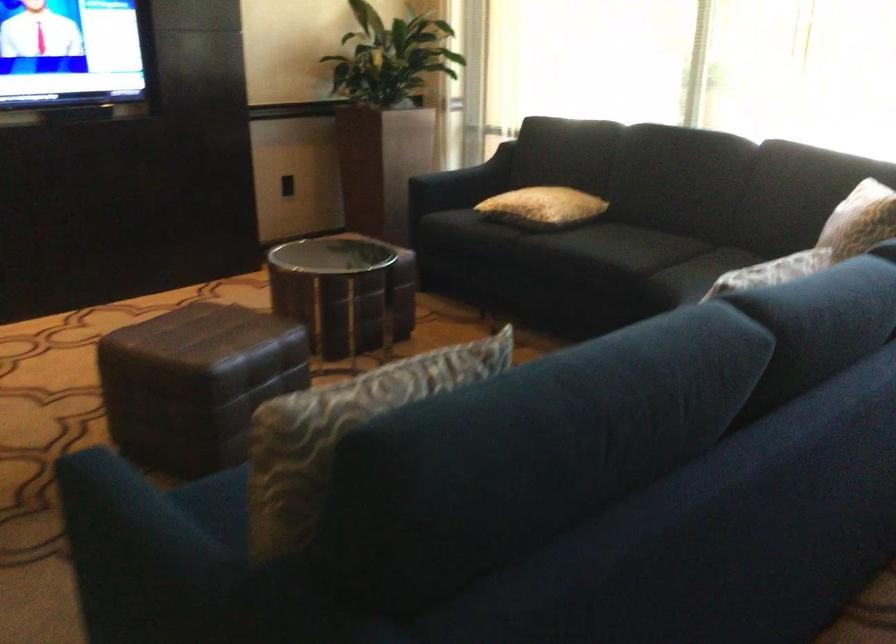
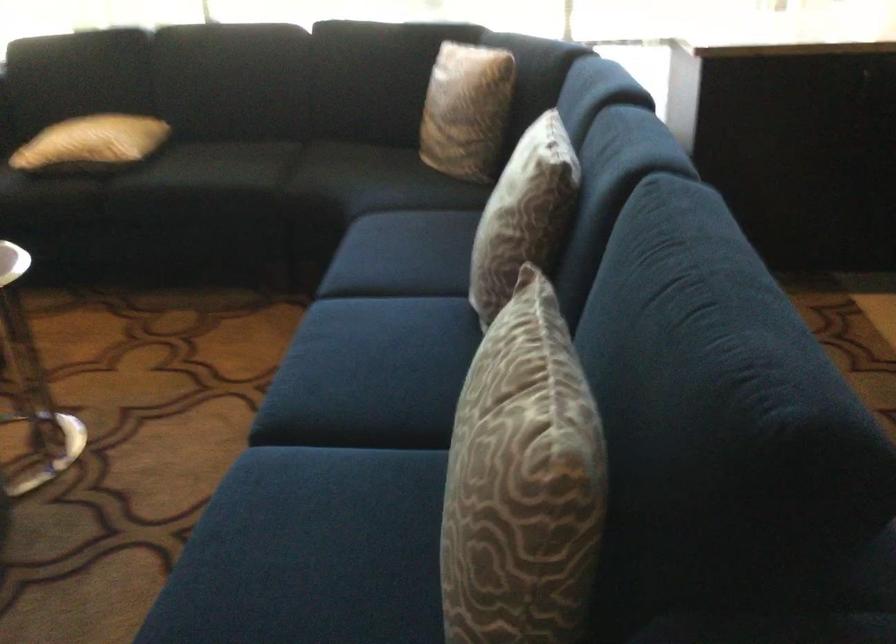
In the second image, find the point that corresponds to [567,145] in the first image.

(82, 64)